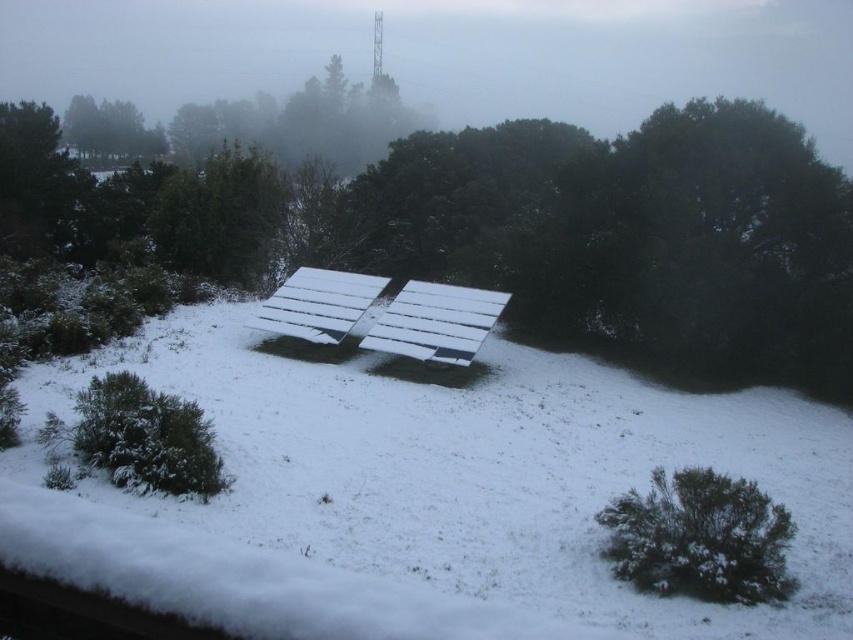
Question: Does white wooden bench at center have a greater width compared to green matte tree at upper left?

Choices:
 (A) no
 (B) yes

Answer: (A)

Question: Does white matte solar panel at center have a lesser width compared to green bush at lower right?

Choices:
 (A) no
 (B) yes

Answer: (A)

Question: Based on their relative distances, which object is nearer to the white plastic bench at center?

Choices:
 (A) white wooden bench at center
 (B) white matte solar panel at center
 (C) green matte tree at upper left
 (D) green bush at lower right

Answer: (A)

Question: Which point is closer to the camera?

Choices:
 (A) white plastic bench at center
 (B) white matte solar panel at center
 (C) white wooden bench at center
 (D) green bush at lower right

Answer: (B)

Question: Which object appears closest to the camera in this image?

Choices:
 (A) green bush at lower right
 (B) white matte solar panel at center
 (C) green matte tree at upper left
 (D) white wooden bench at center

Answer: (B)

Question: Can you confirm if white matte solar panel at center is positioned below white plastic bench at center?

Choices:
 (A) no
 (B) yes

Answer: (B)